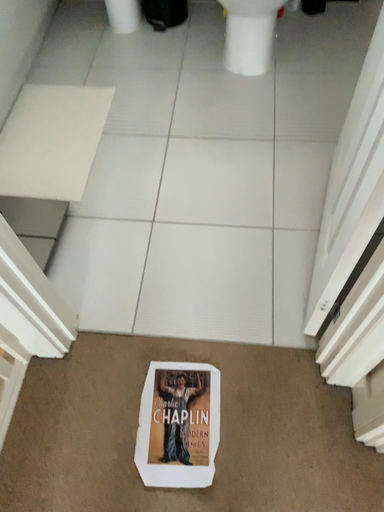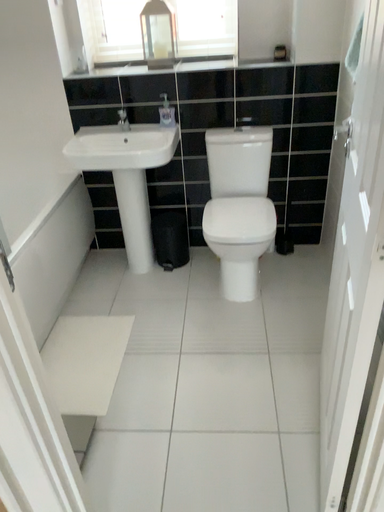
Question: How did the camera likely rotate when shooting the video?

Choices:
 (A) rotated upward
 (B) rotated downward

Answer: (A)